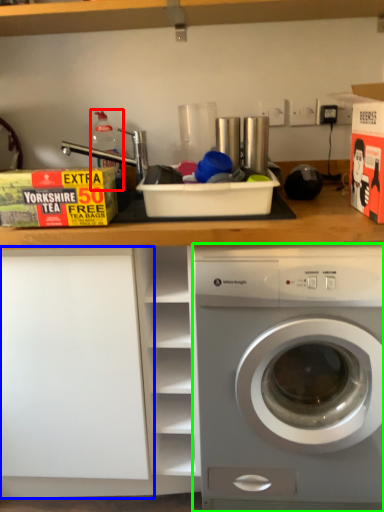
Question: Considering the real-world distances, which object is closest to bottle (highlighted by a red box)? shelf (highlighted by a blue box) or washing machine (highlighted by a green box).

Choices:
 (A) shelf
 (B) washing machine

Answer: (A)